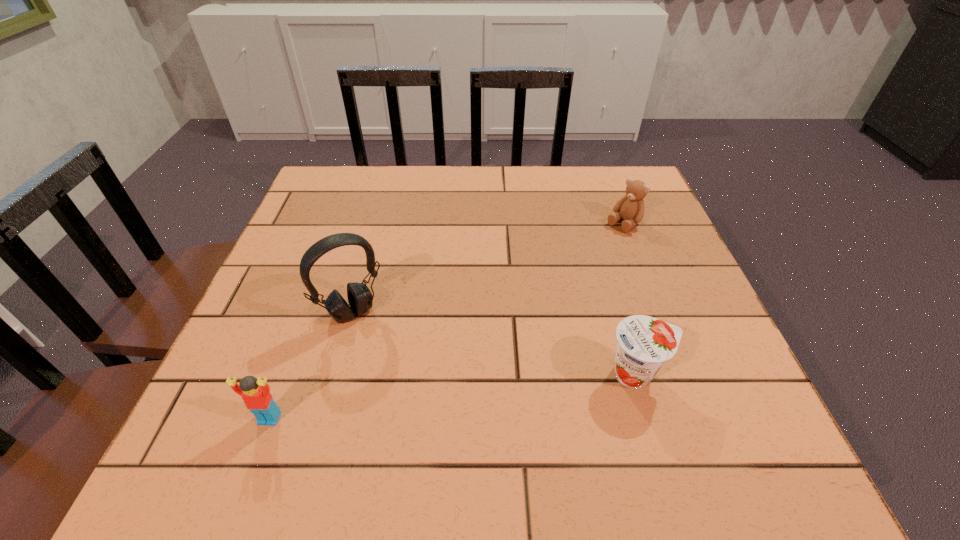
What are the coordinates of `the nearest object` in the screenshot? It's located at point(255,393).

At what (x,y) coordinates should I click in order to perform the action: click on yogurt. Please return your answer as a coordinate pair (x, y). The width and height of the screenshot is (960, 540). Looking at the image, I should click on (644, 344).

Find the location of a particular element. Image resolution: width=960 pixels, height=540 pixels. the tallest object is located at coordinates (360, 298).

You are a GUI agent. You are given a task and a screenshot of the screen. Output one action in this format:
    pyautogui.click(x=<x>, y=<y>)
    Task: Click on the headset
    The width and height of the screenshot is (960, 540).
    Given the screenshot: What is the action you would take?
    pyautogui.click(x=360, y=298)

What are the coordinates of `the farthest object` in the screenshot? It's located at (x=630, y=208).

At what (x,y) coordinates should I click in order to perform the action: click on free space located on the left of the yogurt. Please return your answer as a coordinate pair (x, y). Image resolution: width=960 pixels, height=540 pixels. Looking at the image, I should click on (543, 374).

What are the coordinates of `blank space located 0.070m on the front-facing side of the third nearest object` in the screenshot? It's located at (382, 351).

Where is `free space located 0.210m on the front-facing side of the third nearest object`? free space located 0.210m on the front-facing side of the third nearest object is located at coordinates (419, 406).

The width and height of the screenshot is (960, 540). In order to click on vacant point located 0.340m on the front-facing side of the teddy bear in this screenshot , I will do `click(526, 305)`.

This screenshot has width=960, height=540. I want to click on vacant area located on the front-facing side of the teddy bear, so click(x=547, y=287).